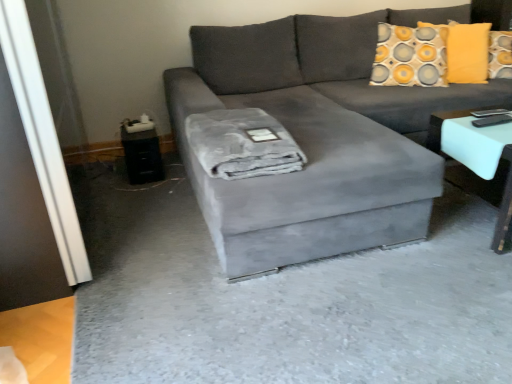
Question: Does transparent glass door at left have a lesser height compared to gray plush blanket at center?

Choices:
 (A) no
 (B) yes

Answer: (A)

Question: Can you confirm if transparent glass door at left is thinner than gray plush blanket at center?

Choices:
 (A) no
 (B) yes

Answer: (A)

Question: Is transparent glass door at left positioned behind gray plush blanket at center?

Choices:
 (A) no
 (B) yes

Answer: (A)

Question: Can you confirm if transparent glass door at left is smaller than gray plush blanket at center?

Choices:
 (A) yes
 (B) no

Answer: (B)

Question: Can you confirm if transparent glass door at left is taller than gray plush blanket at center?

Choices:
 (A) no
 (B) yes

Answer: (B)

Question: Is gray plush blanket at center situated inside velvet gray couch at center or outside?

Choices:
 (A) outside
 (B) inside

Answer: (B)

Question: Looking at their shapes, would you say gray plush blanket at center is wider or thinner than velvet gray couch at center?

Choices:
 (A) wide
 (B) thin

Answer: (B)

Question: Is gray plush blanket at center taller or shorter than velvet gray couch at center?

Choices:
 (A) tall
 (B) short

Answer: (B)

Question: Based on their positions, is gray plush blanket at center located to the left or right of velvet gray couch at center?

Choices:
 (A) right
 (B) left

Answer: (B)

Question: In terms of width, does transparent glass door at left look wider or thinner when compared to black plastic side table at lower left?

Choices:
 (A) thin
 (B) wide

Answer: (B)

Question: Considering the positions of transparent glass door at left and black plastic side table at lower left in the image, is transparent glass door at left taller or shorter than black plastic side table at lower left?

Choices:
 (A) short
 (B) tall

Answer: (B)

Question: Considering their positions, is transparent glass door at left located in front of or behind black plastic side table at lower left?

Choices:
 (A) behind
 (B) front

Answer: (B)

Question: From a real-world perspective, relative to black plastic side table at lower left, is transparent glass door at left vertically above or below?

Choices:
 (A) below
 (B) above

Answer: (B)

Question: From the image's perspective, is black plastic side table at lower left positioned above or below white glossy table at right?

Choices:
 (A) above
 (B) below

Answer: (A)

Question: Looking at their shapes, would you say black plastic side table at lower left is wider or thinner than white glossy table at right?

Choices:
 (A) thin
 (B) wide

Answer: (A)